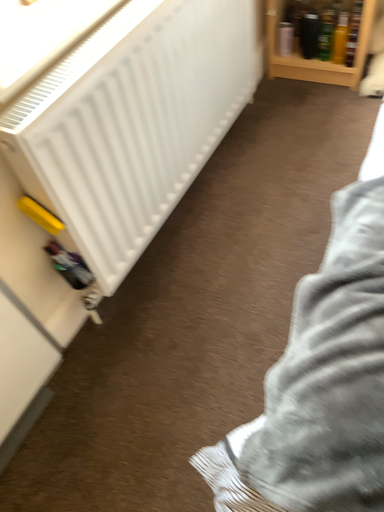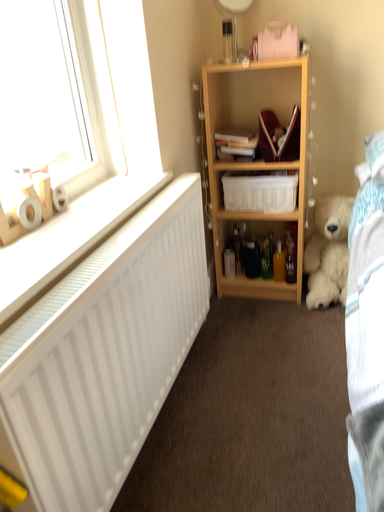
Question: Which way did the camera rotate in the video?

Choices:
 (A) rotated downward
 (B) rotated upward

Answer: (B)